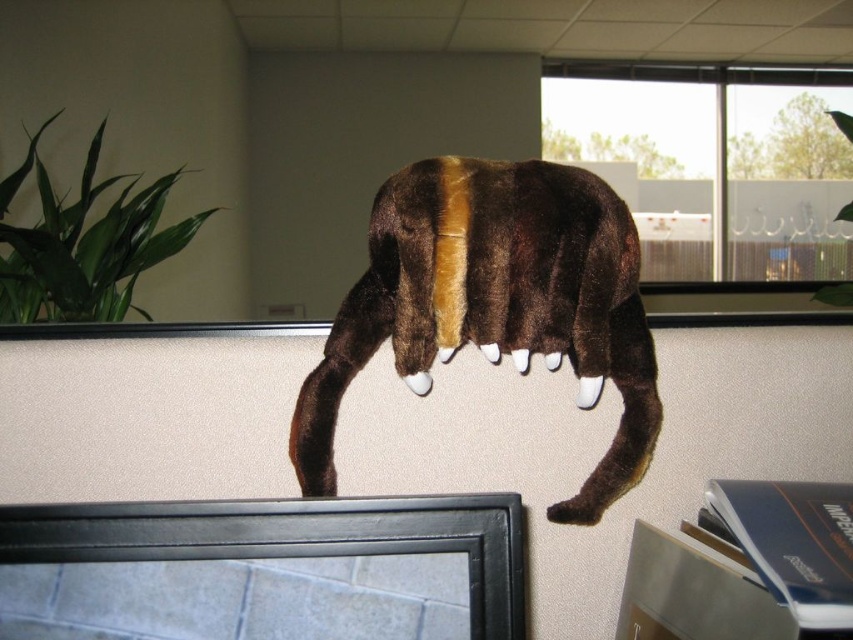
Can you confirm if brown plush toy at center is taller than brown plush tail at center?

Yes, brown plush toy at center is taller than brown plush tail at center.

Is brown plush toy at center positioned at the back of brown plush tail at center?

No, brown plush toy at center is closer to the viewer.

Which is in front, point (546, 291) or point (305, 401)?

Point (546, 291)

What are the coordinates of `brown plush toy at center` in the screenshot? It's located at (495, 304).